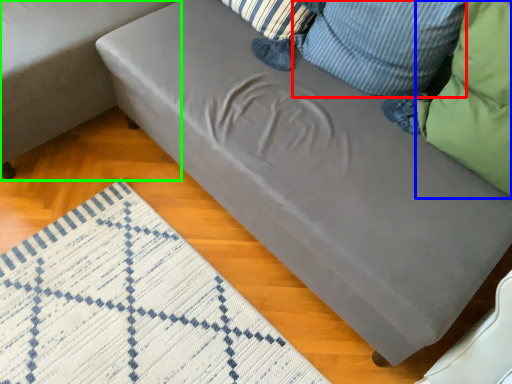
Question: Estimate the real-world distances between objects in this image. Which object is farther from pillow (highlighted by a red box), pillow (highlighted by a blue box) or studio couch (highlighted by a green box)?

Choices:
 (A) pillow
 (B) studio couch

Answer: (B)